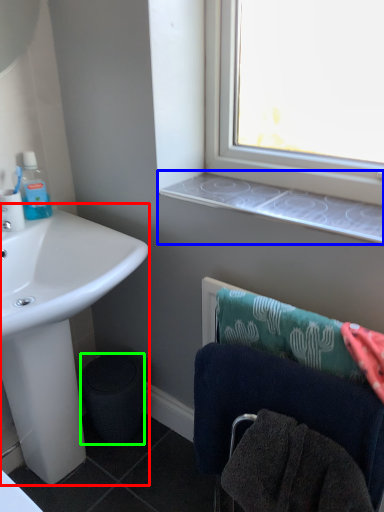
Question: Which object is the closest to the sink (highlighted by a red box)? Choose among these: window sill (highlighted by a blue box) or trash bin/can (highlighted by a green box).

Choices:
 (A) window sill
 (B) trash bin/can

Answer: (B)